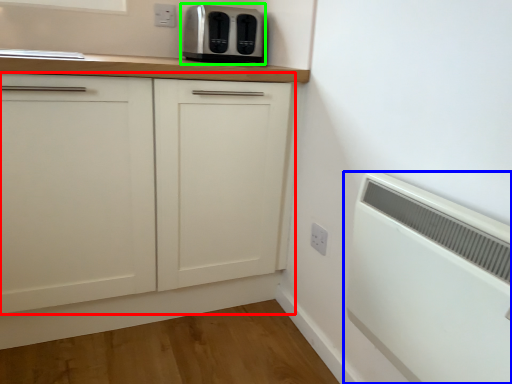
Question: Considering the real-world distances, which object is closest to cabinetry (highlighted by a red box)? home appliance (highlighted by a blue box) or toaster (highlighted by a green box).

Choices:
 (A) home appliance
 (B) toaster

Answer: (B)